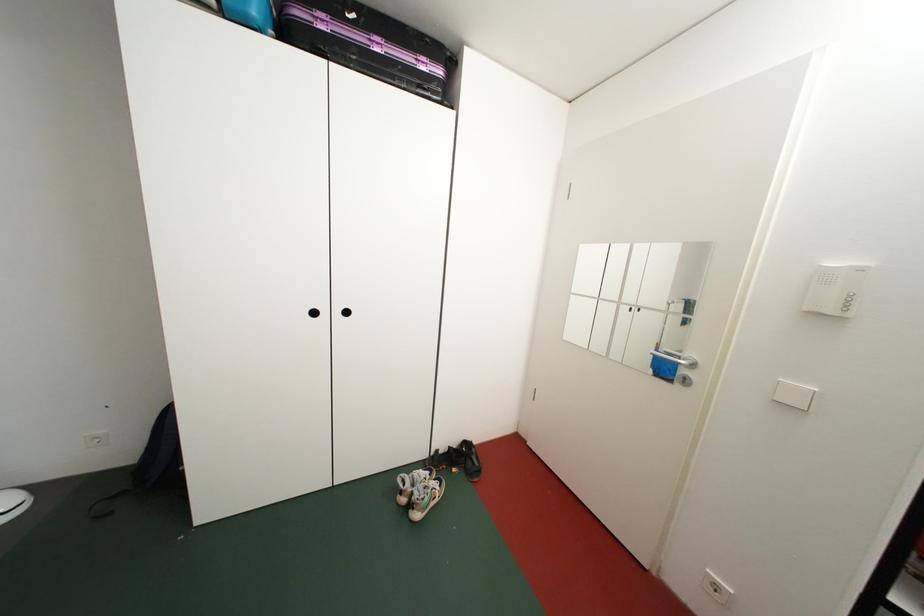
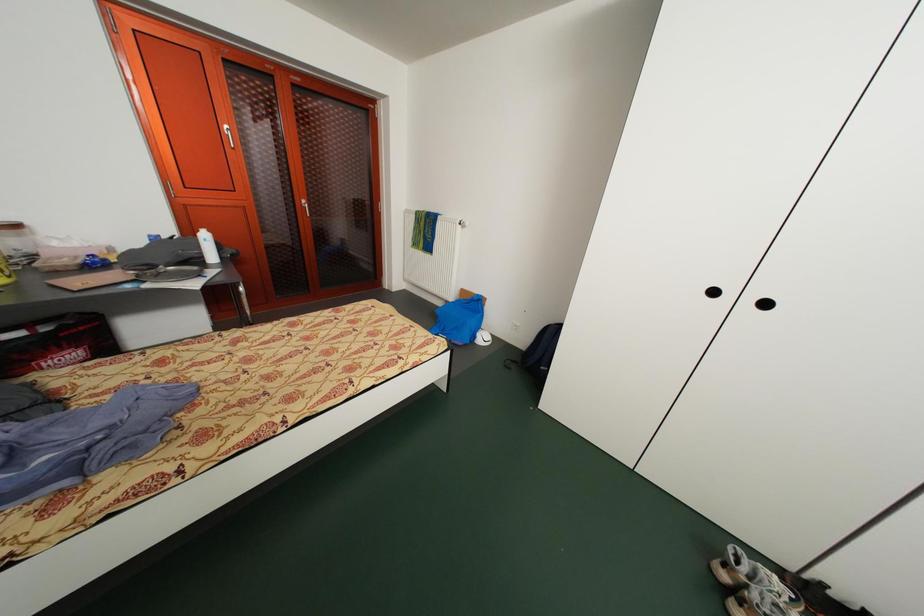
Question: The camera is either moving clockwise (left) or counter-clockwise (right) around the object. The first image is from the beginning of the video and the second image is from the end. Is the camera moving left or right when shooting the video?

Choices:
 (A) Left
 (B) Right

Answer: (B)